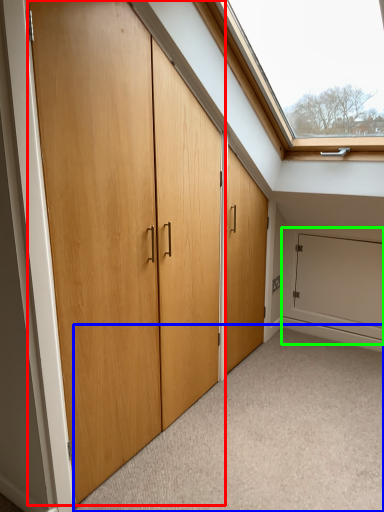
Question: Considering the real-world distances, which object is closest to door (highlighted by a red box)? plain (highlighted by a blue box) or garage door (highlighted by a green box).

Choices:
 (A) plain
 (B) garage door

Answer: (A)